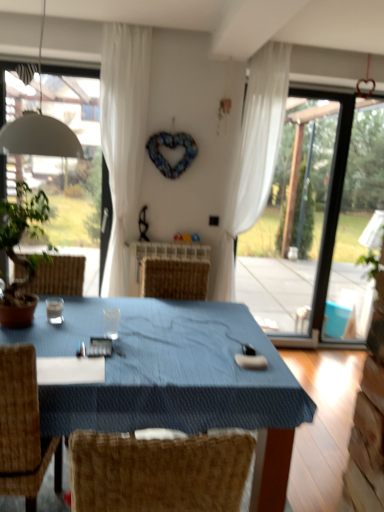
Question: Is transparent glass coffee cup at center to the right of white sheer curtain at upper center, the 2th curtain from the left, from the viewer's perspective?

Choices:
 (A) no
 (B) yes

Answer: (A)

Question: From a real-world perspective, is transparent glass coffee cup at center below white sheer curtain at upper center, the first curtain positioned from the right?

Choices:
 (A) yes
 (B) no

Answer: (A)

Question: Are transparent glass coffee cup at center and white sheer curtain at upper center, the 2th curtain from the left, beside each other?

Choices:
 (A) yes
 (B) no

Answer: (B)

Question: Could you tell me if transparent glass coffee cup at center is turned towards white sheer curtain at upper center, the 2th curtain from the left?

Choices:
 (A) yes
 (B) no

Answer: (B)

Question: Can you confirm if transparent glass coffee cup at center is shorter than white sheer curtain at upper center, the first curtain positioned from the right?

Choices:
 (A) no
 (B) yes

Answer: (B)

Question: Do you think transparent glass coffee cup at center is within white sheer curtain at upper center, the 2th curtain from the left, or outside of it?

Choices:
 (A) outside
 (B) inside

Answer: (A)

Question: Looking at the image, does transparent glass coffee cup at center seem bigger or smaller compared to white sheer curtain at upper center, the first curtain positioned from the right?

Choices:
 (A) small
 (B) big

Answer: (A)

Question: From the image's perspective, is transparent glass coffee cup at center above or below white sheer curtain at upper center, the 2th curtain from the left?

Choices:
 (A) above
 (B) below

Answer: (B)

Question: In terms of width, does transparent glass coffee cup at center look wider or thinner when compared to white sheer curtain at upper center, the first curtain positioned from the right?

Choices:
 (A) thin
 (B) wide

Answer: (A)

Question: Is white matte lampshade at upper left spatially inside transparent glass coffee cup at center, or outside of it?

Choices:
 (A) inside
 (B) outside

Answer: (B)

Question: Is point (39, 130) closer or farther from the camera than point (119, 321)?

Choices:
 (A) farther
 (B) closer

Answer: (B)

Question: In the image, is white matte lampshade at upper left positioned in front of or behind transparent glass coffee cup at center?

Choices:
 (A) front
 (B) behind

Answer: (A)

Question: Would you say white matte lampshade at upper left is to the left or to the right of transparent glass coffee cup at center in the picture?

Choices:
 (A) left
 (B) right

Answer: (A)

Question: Is point (248, 96) closer or farther from the camera than point (107, 334)?

Choices:
 (A) farther
 (B) closer

Answer: (A)

Question: Considering the positions of white sheer curtain at upper center, the 2th curtain from the left, and transparent glass coffee cup at center in the image, is white sheer curtain at upper center, the 2th curtain from the left, taller or shorter than transparent glass coffee cup at center?

Choices:
 (A) short
 (B) tall

Answer: (B)